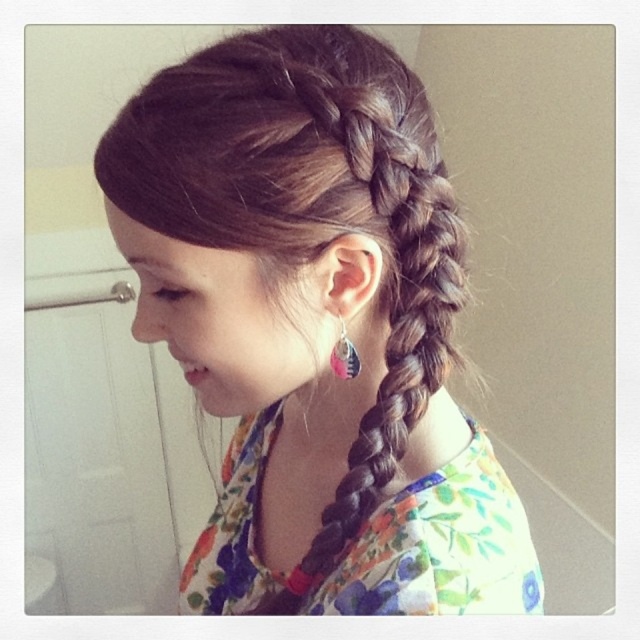
Which is behind, point (484, 436) or point (352, 371)?

Point (484, 436)

Measure the distance from dark brown hair at center to pink fabric earring at ear.

dark brown hair at center and pink fabric earring at ear are 5.66 inches apart from each other.

In the scene shown: Measure the distance between dark brown hair at center and camera.

A distance of 14.90 inches exists between dark brown hair at center and camera.

The height and width of the screenshot is (640, 640). I want to click on dark brown hair at center, so [316, 326].